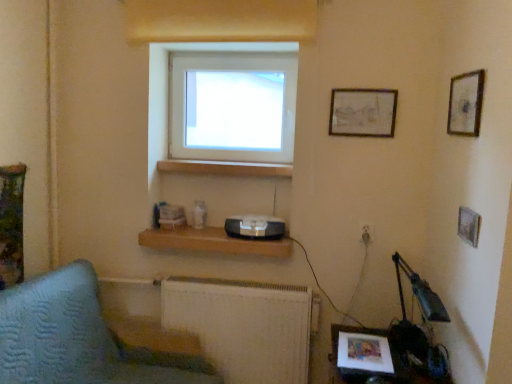
What is the approximate width of wooden at center?

wooden at center is 3.66 inches wide.

This screenshot has height=384, width=512. Describe the element at coordinates (375, 357) in the screenshot. I see `wooden table at lower right` at that location.

This screenshot has width=512, height=384. Describe the element at coordinates (168, 84) in the screenshot. I see `transparent glass window at upper center` at that location.

Locate an element on the screen. textured fabric sofa at lower left is located at coordinates (69, 336).

This screenshot has height=384, width=512. I want to click on white metallic radiator at lower center, so click(244, 326).

What is the approximate height of wooden shelf at center?

It is 2.87 inches.

Image resolution: width=512 pixels, height=384 pixels. In order to click on wooden at center in this screenshot , I will do `click(226, 168)`.

Which is in front, point (262, 165) or point (368, 109)?

The point (368, 109) is in front.

The width and height of the screenshot is (512, 384). I want to click on the 1st picture frame above the wooden at center (from a real-world perspective), so click(x=362, y=112).

Looking at this image, would you say wooden at center is inside or outside matte wooden picture frame at upper right, which ranks as the 2th picture frame in right-to-left order?

wooden at center is not inside matte wooden picture frame at upper right, which ranks as the 2th picture frame in right-to-left order, it's outside.

Can you confirm if wooden at center is bigger than matte wooden picture frame at upper right, acting as the first picture frame starting from the back?

Indeed, wooden at center has a larger size compared to matte wooden picture frame at upper right, acting as the first picture frame starting from the back.

From the image's perspective, is wooden shelf at center located above or below white metallic radiator at lower center?

wooden shelf at center is situated higher than white metallic radiator at lower center in the image.

Considering the sizes of wooden shelf at center and white metallic radiator at lower center in the image, is wooden shelf at center taller or shorter than white metallic radiator at lower center?

Considering their sizes, wooden shelf at center has less height than white metallic radiator at lower center.

From a real-world perspective, is wooden shelf at center physically below white metallic radiator at lower center?

No, from a real-world perspective, wooden shelf at center is not below white metallic radiator at lower center.

Between point (205, 244) and point (304, 380), which one is positioned in front?

Point (205, 244)

Can you tell me how much white metallic radiator at lower center and wooden at center differ in facing direction?

white metallic radiator at lower center and wooden at center are facing 1.2 degrees away from each other.

From the image's perspective, is white metallic radiator at lower center above wooden at center?

No, from the image's perspective, white metallic radiator at lower center is not on top of wooden at center.

Is white metallic radiator at lower center aimed at wooden at center?

No, white metallic radiator at lower center does not turn towards wooden at center.

There is a white metallic radiator at lower center. Identify the location of window sill above it (from a real-world perspective). This screenshot has height=384, width=512. (226, 168).

Which object is positioned more to the left, transparent glass window at upper center or wooden shelf at center?

wooden shelf at center is more to the left.

From a real-world perspective, is transparent glass window at upper center positioned above or below wooden shelf at center?

transparent glass window at upper center is situated higher than wooden shelf at center in the real world.

Is transparent glass window at upper center outside of wooden shelf at center?

Yes.

From the image's perspective, who appears lower, wooden framed picture at upper right, which ranks as the 2th picture frame in left-to-right order, or wooden at center?

wooden at center appears lower in the image.

Can you confirm if wooden framed picture at upper right, the 2th picture frame from the back, is bigger than wooden at center?

No, wooden framed picture at upper right, the 2th picture frame from the back, is not bigger than wooden at center.

Which is closer, (466,81) or (287,177)?

Point (466,81) is positioned closer to the camera compared to point (287,177).

This screenshot has height=384, width=512. In order to click on window sill below the wooden framed picture at upper right, the 2th picture frame from the back (from a real-world perspective) in this screenshot , I will do `click(226, 168)`.

Is textured fabric sofa at lower left inside the boundaries of wooden table at lower right, or outside?

textured fabric sofa at lower left lies outside wooden table at lower right.

What's the angular difference between textured fabric sofa at lower left and wooden table at lower right's facing directions?

The angular difference between textured fabric sofa at lower left and wooden table at lower right is 179 degrees.

Considering the relative sizes of textured fabric sofa at lower left and wooden table at lower right in the image provided, is textured fabric sofa at lower left thinner than wooden table at lower right?

No.

Between textured fabric sofa at lower left and wooden table at lower right, which one has smaller size?

Smaller between the two is wooden table at lower right.

Which is more to the left, wooden table at lower right or wooden shelf at center?

Positioned to the left is wooden shelf at center.

Looking at this image, how different are the orientations of wooden table at lower right and wooden shelf at center in degrees?

The facing directions of wooden table at lower right and wooden shelf at center are 90.1 degrees apart.

Is wooden table at lower right wider than wooden shelf at center?

Indeed, wooden table at lower right has a greater width compared to wooden shelf at center.

Could you tell me if wooden table at lower right is turned towards wooden shelf at center?

No.

Locate an element on the screen. The height and width of the screenshot is (384, 512). picture frame that is the 1st object located in front of the wooden at center is located at coordinates (362, 112).

This screenshot has height=384, width=512. I want to click on shelf that appears on the left of white metallic radiator at lower center, so click(212, 242).

When comparing their distances from matte wooden picture frame at upper right, acting as the first picture frame starting from the back, does wooden shelf at center or textured fabric sofa at lower left seem closer?

The object closer to matte wooden picture frame at upper right, acting as the first picture frame starting from the back, is wooden shelf at center.

Based on their spatial positions, is wooden at center or wooden table at lower right closer to wooden framed picture at upper right, the first picture frame viewed from the front?

Among the two, wooden table at lower right is located nearer to wooden framed picture at upper right, the first picture frame viewed from the front.

Which object lies nearer to the anchor point wooden shelf at center, white metallic radiator at lower center or wooden table at lower right?

white metallic radiator at lower center is positioned closer to the anchor wooden shelf at center.

Estimate the real-world distances between objects in this image. Which object is further from wooden framed picture at upper right, the first picture frame viewed from the front, wooden shelf at center or wooden table at lower right?

wooden shelf at center is further to wooden framed picture at upper right, the first picture frame viewed from the front.

Considering their positions, is wooden at center positioned closer to transparent glass window at upper center than white metallic radiator at lower center?

Among the two, wooden at center is located nearer to transparent glass window at upper center.

Which object lies further to the anchor point transparent glass window at upper center, white metallic radiator at lower center or textured fabric sofa at lower left?

white metallic radiator at lower center lies further to transparent glass window at upper center than the other object.

Looking at the image, which one is located further to wooden framed picture at upper right, which ranks as the 2th picture frame in left-to-right order, wooden shelf at center or matte wooden picture frame at upper right, which ranks as the 2th picture frame in right-to-left order?

wooden shelf at center is further to wooden framed picture at upper right, which ranks as the 2th picture frame in left-to-right order.

Considering their positions, is textured fabric sofa at lower left positioned further to matte wooden picture frame at upper right, which appears as the first picture frame when viewed from the left, than wooden table at lower right?

textured fabric sofa at lower left is further to matte wooden picture frame at upper right, which appears as the first picture frame when viewed from the left.

Where is `window sill between wooden shelf at center and wooden framed picture at upper right, acting as the first picture frame starting from the right`? The width and height of the screenshot is (512, 384). window sill between wooden shelf at center and wooden framed picture at upper right, acting as the first picture frame starting from the right is located at coordinates (226, 168).

Where is `electric outlet located between textured fabric sofa at lower left and wooden framed picture at upper right, acting as the first picture frame starting from the right, in the left-right direction`? The width and height of the screenshot is (512, 384). electric outlet located between textured fabric sofa at lower left and wooden framed picture at upper right, acting as the first picture frame starting from the right, in the left-right direction is located at coordinates (366, 235).

You are a GUI agent. You are given a task and a screenshot of the screen. Output one action in this format:
    pyautogui.click(x=<x>, y=<y>)
    Task: Click on the shelf located between textured fabric sofa at lower left and wooden table at lower right in the left-right direction
    
    Given the screenshot: What is the action you would take?
    [x=212, y=242]

I want to click on window sill between wooden framed picture at upper right, the 2th picture frame from the back, and wooden table at lower right from top to bottom, so click(x=226, y=168).